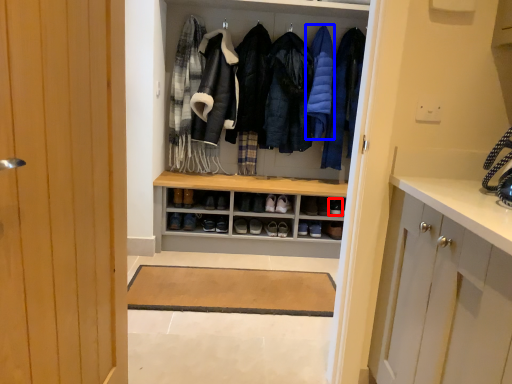
Question: Which object appears closest to the camera in this image, shoe (highlighted by a red box) or garment (highlighted by a blue box)?

Choices:
 (A) shoe
 (B) garment

Answer: (B)